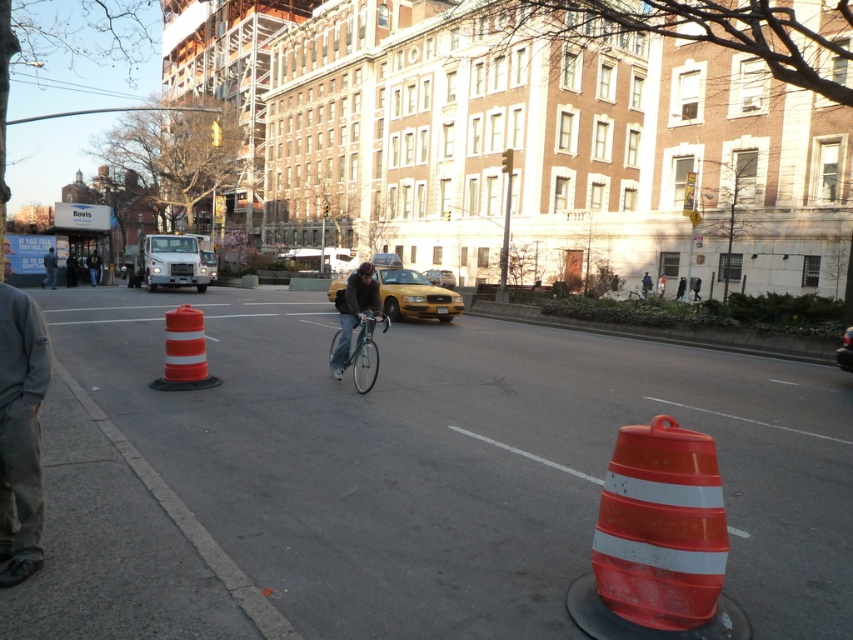
You are standing on the sidewalk and see the orange reflective cone at center ahead of you. If you want to place a sign that is 10 feet long in front of the cone, will it fit between you and the cone?

The orange reflective cone at center is 11.49 feet away from you. Since the sign is 10 feet long, there is enough space between you and the cone to place the sign.

You are standing at the point marked as point [9,397] in the image. A cyclist is approaching from the direction of the construction zone marked by orange traffic barrels. If the cyclist is moving at 15 km per hour, how many seconds will it take for the cyclist to reach you?

The distance between you and the point [9,397] is 4.03 meters. To calculate the time, convert 15 km per hour to meters per second by dividing by 3.6, resulting in approximately 4.17 mps. Divide the distance by speed to get 4.03 meters divided by 4.17 mps equals roughly 0.968 seconds. Therefore, the cyclist will reach you in approximately 1 second.

Looking at this image, you are a pedestrian standing at the edge of the road. You see an orange reflective cone at center and a dark gray jacket at center. Which object is closer to you?

The orange reflective cone at center is 25.70 meters away from dark gray jacket at center, so the dark gray jacket at center is closer to you since it is positioned at center while the cone is also at center but the distance between them suggests the jacket is in front.